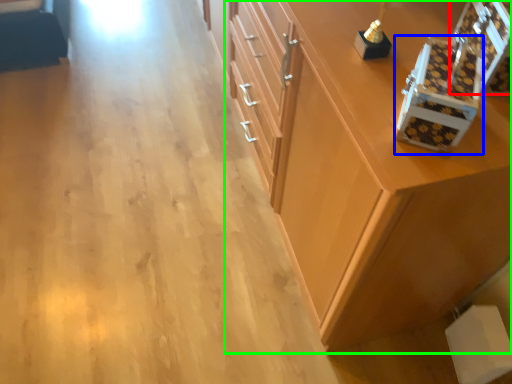
Question: Which object is the closest to the box (highlighted by a red box)? Choose among these: box (highlighted by a blue box) or cabinetry (highlighted by a green box).

Choices:
 (A) box
 (B) cabinetry

Answer: (A)